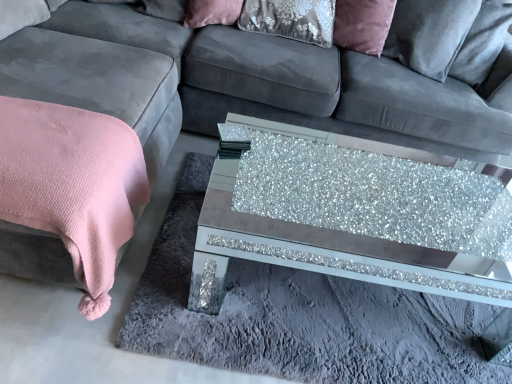
Question: From a real-world perspective, relative to pink textured blanket at left, is glittery glass coffee table at center vertically above or below?

Choices:
 (A) above
 (B) below

Answer: (B)

Question: Do you think glittery glass coffee table at center is within pink textured blanket at left, or outside of it?

Choices:
 (A) outside
 (B) inside

Answer: (A)

Question: Estimate the real-world distances between objects in this image. Which object is closer to the pink textured blanket at left?

Choices:
 (A) glittery glass coffee table at center
 (B) velvet/matte pillow at upper center

Answer: (B)

Question: Considering the real-world distances, which object is closest to the velvet/matte pillow at upper center?

Choices:
 (A) glittery glass coffee table at center
 (B) pink textured blanket at left

Answer: (B)